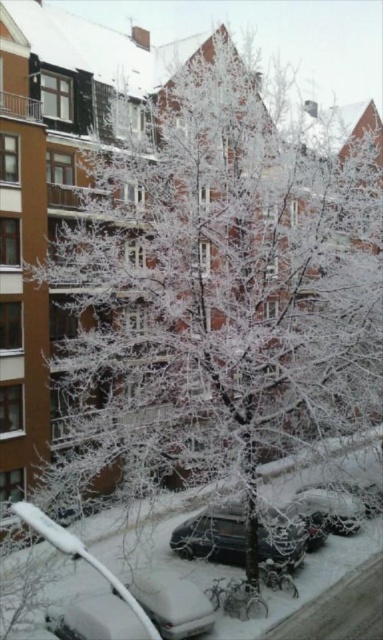
You are a delivery person trying to park your vehicle in this winter scene. You see a white matte car at lower left and a white frosted car at center. Which car is positioned lower in the image?

The white matte car at lower left is positioned lower than the white frosted car at center.

You are standing in the winter scene and want to know how far you are from the point marked at coordinates point [176,576]. Can you determine the distance?

The point marked at coordinates point [176,576] is 21.58 meters away from you.

You are a delivery person trying to park your shiny black car at center in a parking spot that can only accommodate vehicles up to the size of the white matte car at lower left. Based on the scene description, will your car fit?

The shiny black car at center has a smaller size compared to the white matte car at lower left, so it will fit in the parking spot designed for the white matte car at lower left.